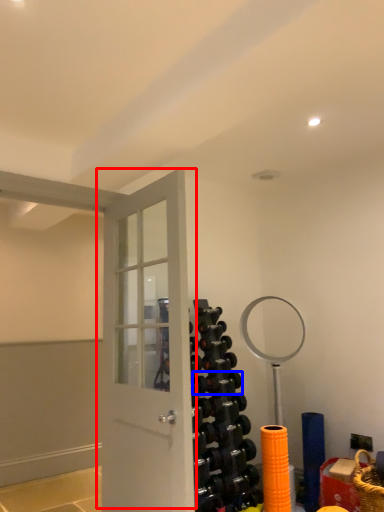
Question: Which object is closer to the camera taking this photo, door (highlighted by a red box) or dumbbell (highlighted by a blue box)?

Choices:
 (A) door
 (B) dumbbell

Answer: (A)